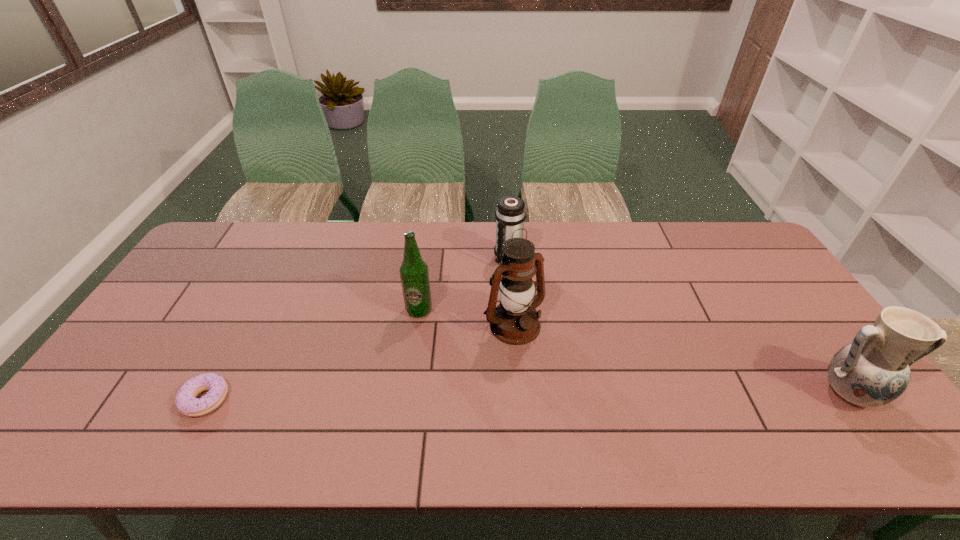
Find the location of a particular element. Image resolution: width=960 pixels, height=540 pixels. free spot between the lantern and the rightmost object is located at coordinates (x=681, y=359).

What are the coordinates of `vacant space that is in between the fourth object from right to left and the farthest object` in the screenshot? It's located at (464, 285).

Image resolution: width=960 pixels, height=540 pixels. In order to click on vacant region between the pottery and the farthest object in this screenshot , I will do `click(678, 326)`.

The image size is (960, 540). Identify the location of vacant area that lies between the tallest object and the pottery. (681, 359).

Identify the location of vacant space in between the leftmost object and the farthest object. (357, 329).

Select which object appears as the closest to the thermos bottle. Please provide its 2D coordinates. Your answer should be formatted as a tuple, i.e. [(x, y)], where the tuple contains the x and y coordinates of a point satisfying the conditions above.

[(515, 321)]

Identify the location of object that is the closest one to the lantern. (414, 274).

Identify the location of vacant space that satisfies the following two spatial constraints: 1. on the front side of the fourth tallest object; 2. on the left side of the tallest object. The height and width of the screenshot is (540, 960). (514, 325).

What are the coordinates of `vacant position in the image that satisfies the following two spatial constraints: 1. on the back side of the beer bottle; 2. on the right side of the doughnut` in the screenshot? It's located at (252, 310).